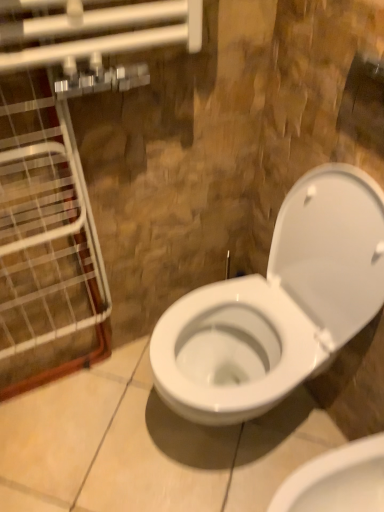
The width and height of the screenshot is (384, 512). What are the coordinates of `vacant region below white glossy toilet at center, the second toilet from the bottom (from a real-world perspective)` in the screenshot? It's located at (247, 431).